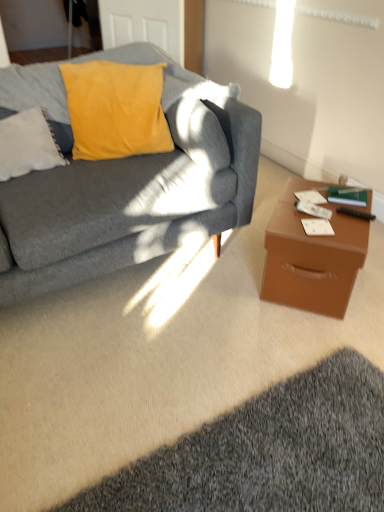
Locate an element on the screen. free area in between black plastic remote control at right and green matte book at right is located at coordinates (349, 210).